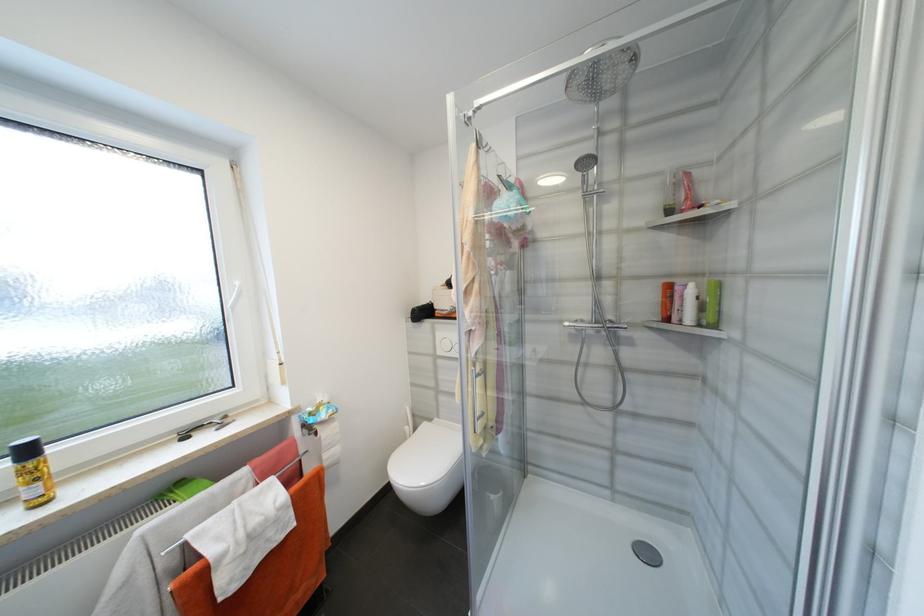
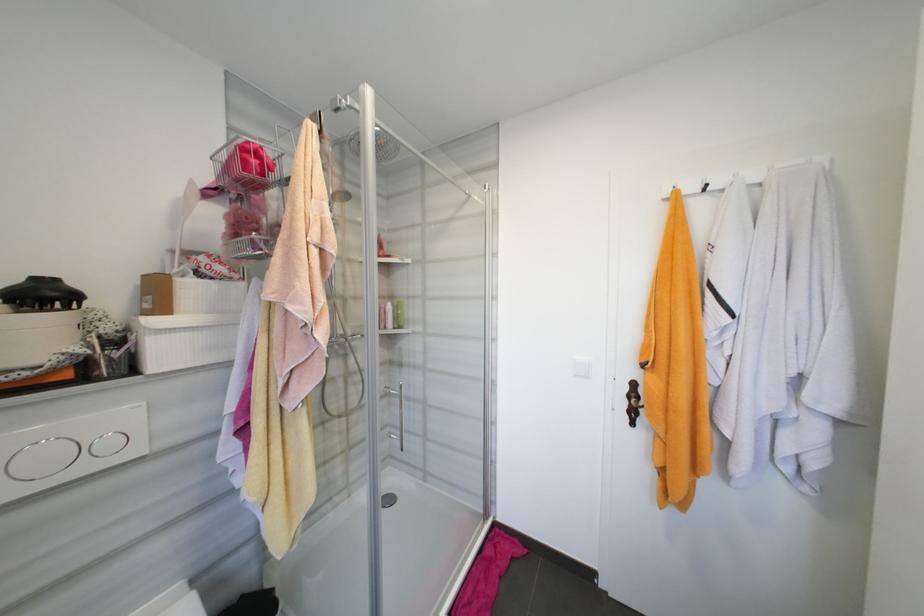
Question: The camera is either moving clockwise (left) or counter-clockwise (right) around the object. The first image is from the beginning of the video and the second image is from the end. Is the camera moving left or right when shooting the video?

Choices:
 (A) Left
 (B) Right

Answer: (A)